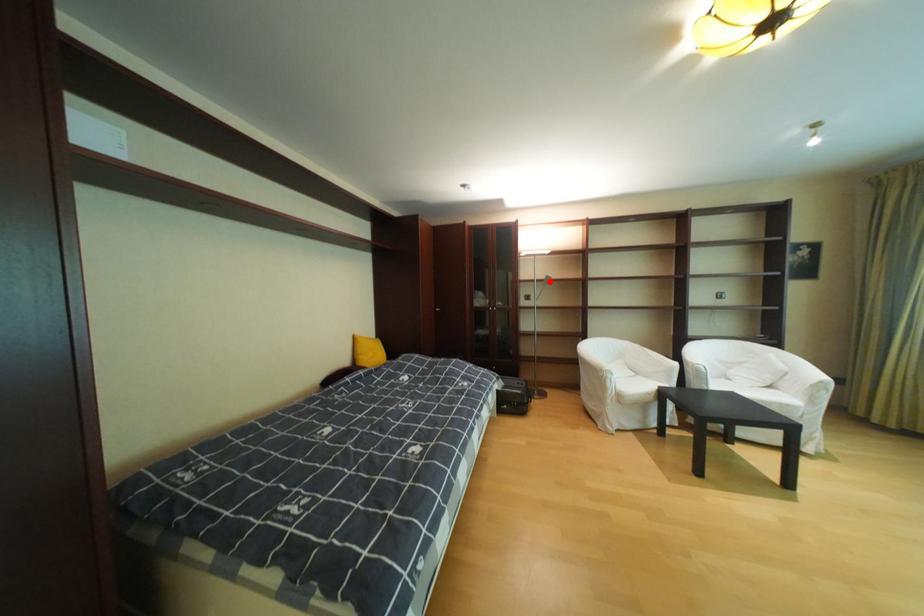
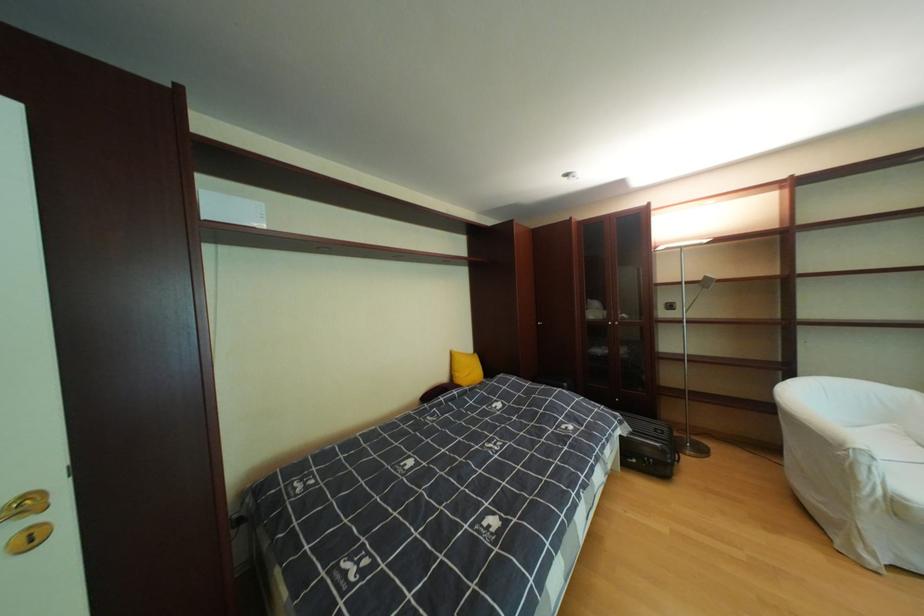
Question: I am providing you with two images of the same scene from different viewpoints. A red point is marked on the first image. Can you still see the location of the red point in image 2?

Choices:
 (A) Yes
 (B) No

Answer: (A)